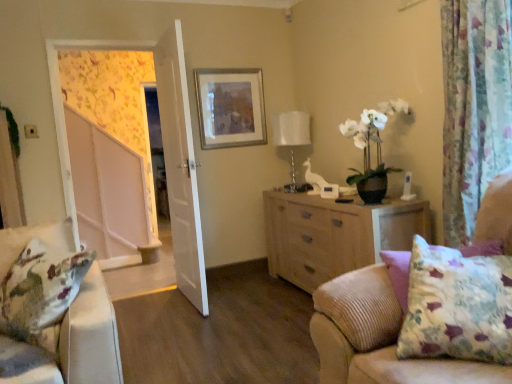
Identify the location of white glossy screen door at left. The image size is (512, 384). (109, 194).

Find the location of a particular element. The height and width of the screenshot is (384, 512). white wooden door at center is located at coordinates (180, 167).

What do you see at coordinates (334, 235) in the screenshot? The image size is (512, 384). I see `light wood dresser at center` at bounding box center [334, 235].

What do you see at coordinates (474, 106) in the screenshot? This screenshot has height=384, width=512. I see `floral fabric curtain at right` at bounding box center [474, 106].

At what (x,y) coordinates should I click in order to perform the action: click on white glossy screen door at left. Please return your answer as a coordinate pair (x, y). This screenshot has width=512, height=384. Looking at the image, I should click on (109, 194).

Does fluffy beige couch at lower right appear on the left side of white glossy table lamp at upper center?

No.

How much distance is there between fluffy beige couch at lower right and white glossy table lamp at upper center?

They are 2.20 meters apart.

How many degrees apart are the facing directions of fluffy beige couch at lower right and white glossy table lamp at upper center?

0.695 degrees.

Is white glossy table lamp at upper center a part of fluffy beige couch at lower right?

No, white glossy table lamp at upper center is not inside fluffy beige couch at lower right.

Is white wooden door at center at the right side of white glossy screen door at left?

Yes, white wooden door at center is to the right of white glossy screen door at left.

Is white wooden door at center closer to the viewer compared to white glossy screen door at left?

Yes, white wooden door at center is closer to the viewer.

Can white glossy screen door at left be found inside white wooden door at center?

Actually, white glossy screen door at left is outside white wooden door at center.

Considering the points (164, 135) and (94, 147), which point is behind, point (164, 135) or point (94, 147)?

The point (94, 147) is farther.

Who is smaller, white wooden door at center or floral fabric curtain at right?

With smaller size is floral fabric curtain at right.

Looking at this image, which is in front, white wooden door at center or floral fabric curtain at right?

floral fabric curtain at right.

From a real-world perspective, is white wooden door at center physically below floral fabric curtain at right?

Yes, from a real-world perspective, white wooden door at center is under floral fabric curtain at right.

Which of these two, white wooden door at center or floral fabric curtain at right, is wider?

floral fabric curtain at right.

From a real-world perspective, is white glossy screen door at left physically located above or below floral fabric curtain at right?

Clearly, from a real-world perspective, white glossy screen door at left is below floral fabric curtain at right.

Is white glossy screen door at left bigger or smaller than floral fabric curtain at right?

white glossy screen door at left is smaller than floral fabric curtain at right.

Which object is further away from the camera taking this photo, white glossy screen door at left or floral fabric curtain at right?

white glossy screen door at left.

From the image's perspective, who appears lower, white glossy screen door at left or floral fabric curtain at right?

white glossy screen door at left appears lower in the image.

Find the location of `table lamp behind the white wooden door at center`. table lamp behind the white wooden door at center is located at coordinates (292, 135).

From a real-world perspective, between white wooden door at center and white glossy table lamp at upper center, who is vertically higher?

white glossy table lamp at upper center is physically above.

Is point (183, 252) closer or farther from the camera than point (298, 113)?

Clearly, point (183, 252) is closer to the camera than point (298, 113).

Are white wooden door at center and white glossy table lamp at upper center beside each other?

No, white wooden door at center is not with white glossy table lamp at upper center.

Is point (451, 234) less distant than point (321, 238)?

Yes, it is.

Would you consider floral fabric curtain at right to be distant from light wood dresser at center?

That's not correct — floral fabric curtain at right is a little close to light wood dresser at center.

From a real-world perspective, is floral fabric curtain at right physically below light wood dresser at center?

No, from a real-world perspective, floral fabric curtain at right is not beneath light wood dresser at center.

Is white glossy table lamp at upper center closer to camera compared to fluffy beige couch at lower right?

No, it is behind fluffy beige couch at lower right.

Considering the positions of point (303, 114) and point (345, 353), is point (303, 114) closer or farther from the camera than point (345, 353)?

Point (303, 114) appears to be farther away from the viewer than point (345, 353).

Is white glossy table lamp at upper center next to fluffy beige couch at lower right?

They are not placed beside each other.

Where is `table lamp above the fluffy beige couch at lower right (from the image's perspective)`? The width and height of the screenshot is (512, 384). table lamp above the fluffy beige couch at lower right (from the image's perspective) is located at coordinates (292, 135).

Identify the location of door below the white glossy screen door at left (from the image's perspective). (180, 167).

Which object lies further to the anchor point white glossy table lamp at upper center, white glossy screen door at left or floral fabric curtain at right?

white glossy screen door at left lies further to white glossy table lamp at upper center than the other object.

Estimate the real-world distances between objects in this image. Which object is closer to fluffy beige couch at lower right, floral fabric curtain at right or silver metallic picture frame at upper center?

The object closer to fluffy beige couch at lower right is floral fabric curtain at right.

Consider the image. From the image, which object appears to be farther from silver metallic picture frame at upper center, white glossy screen door at left or white glossy table lamp at upper center?

white glossy screen door at left is positioned further to the anchor silver metallic picture frame at upper center.

Looking at the image, which one is located closer to light wood dresser at center, fluffy beige couch at lower right or silver metallic picture frame at upper center?

silver metallic picture frame at upper center.

When comparing their distances from floral fabric curtain at right, does white glossy table lamp at upper center or silver metallic picture frame at upper center seem closer?

The object closer to floral fabric curtain at right is white glossy table lamp at upper center.

Consider the image. From the image, which object appears to be farther from white wooden door at center, silver metallic picture frame at upper center or white glossy table lamp at upper center?

white glossy table lamp at upper center lies further to white wooden door at center than the other object.

Looking at the image, which one is located further to light wood dresser at center, white glossy table lamp at upper center or floral fabric curtain at right?

floral fabric curtain at right lies further to light wood dresser at center than the other object.

Based on their spatial positions, is white glossy screen door at left or silver metallic picture frame at upper center further from white glossy table lamp at upper center?

Based on the image, white glossy screen door at left appears to be further to white glossy table lamp at upper center.

This screenshot has width=512, height=384. Identify the location of cabinetry between fluffy beige couch at lower right and white glossy table lamp at upper center in the front-back direction. (334, 235).

This screenshot has width=512, height=384. What are the coordinates of `table lamp between white glossy screen door at left and light wood dresser at center` in the screenshot? It's located at (292, 135).

In order to click on cabinetry between white wooden door at center and floral fabric curtain at right from left to right in this screenshot , I will do `click(334, 235)`.

Where is `table lamp between white wooden door at center and light wood dresser at center in the horizontal direction`? This screenshot has height=384, width=512. table lamp between white wooden door at center and light wood dresser at center in the horizontal direction is located at coordinates (292, 135).